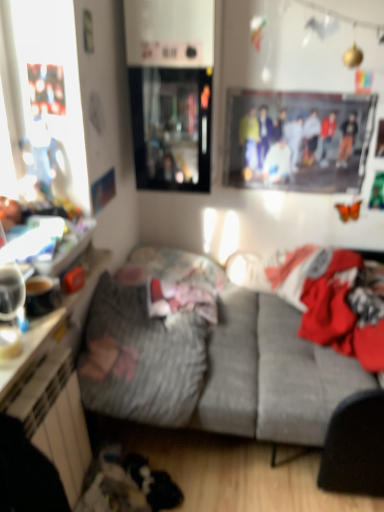
You are a GUI agent. You are given a task and a screenshot of the screen. Output one action in this format:
    pyautogui.click(x=<x>, y=<y>)
    Task: Click on the white glossy dresser at lower left
    Image resolution: width=384 pixels, height=512 pixels.
    Given the screenshot: What is the action you would take?
    pyautogui.click(x=57, y=378)

Measure the distance between printed fabric poster at upper center and camera.

printed fabric poster at upper center is 2.24 meters away from camera.

This screenshot has height=512, width=384. What do you see at coordinates (209, 360) in the screenshot?
I see `gray fabric couch at center` at bounding box center [209, 360].

Find the location of a particular element. The image size is (384, 512). transparent glass cabinet at upper center is located at coordinates (171, 127).

Considering the relative positions of transparent glass cabinet at upper center and white glossy dresser at lower left in the image provided, is transparent glass cabinet at upper center to the right of white glossy dresser at lower left from the viewer's perspective?

Yes.

Can you confirm if transparent glass cabinet at upper center is smaller than white glossy dresser at lower left?

Incorrect, transparent glass cabinet at upper center is not smaller in size than white glossy dresser at lower left.

In the scene shown: Is transparent glass cabinet at upper center directly adjacent to white glossy dresser at lower left?

They are not placed beside each other.

Measure the distance between transparent glass cabinet at upper center and white glossy dresser at lower left.

transparent glass cabinet at upper center is 90.31 centimeters away from white glossy dresser at lower left.

The image size is (384, 512). Find the location of `blanket in front of the transparent glass cabinet at upper center`. blanket in front of the transparent glass cabinet at upper center is located at coordinates (141, 358).

From the image's perspective, does transparent glass cabinet at upper center appear lower than fluffy gray blanket at center?

No.

Can you confirm if transparent glass cabinet at upper center is wider than fluffy gray blanket at center?

No, transparent glass cabinet at upper center is not wider than fluffy gray blanket at center.

At what (x,y) coordinates should I click in order to perform the action: click on couple on the right of gray fabric couch at center. Please return your answer as a coordinate pair (x, y). Image resolution: width=384 pixels, height=512 pixels. Looking at the image, I should click on (281, 143).

Is point (280, 178) farther from camera compared to point (189, 362)?

Yes.

Between printed fabric poster at upper center and gray fabric couch at center, which one appears on the right side from the viewer's perspective?

printed fabric poster at upper center is more to the right.

Who is bigger, printed fabric poster at upper center or gray fabric couch at center?

gray fabric couch at center is bigger.

Does red fabric laundry at center turn towards transparent glass cabinet at upper center?

No.

Which is closer, (337,251) or (161,137)?

Point (337,251) is positioned farther from the camera compared to point (161,137).

Find the location of `window screen behind the red fabric laundry at center`. window screen behind the red fabric laundry at center is located at coordinates (171, 127).

Between transparent glass cabinet at upper center and red fabric laundry at center, which one has less height?

red fabric laundry at center.

In the scene shown: Looking at the image, does transparent glass cabinet at upper center seem bigger or smaller compared to red fabric laundry at center?

In the image, transparent glass cabinet at upper center appears to be smaller than red fabric laundry at center.

From the image's perspective, which object appears higher, transparent glass cabinet at upper center or red fabric laundry at center?

transparent glass cabinet at upper center is shown above in the image.

Find the location of a particular element. This screenshot has width=384, height=512. laundry below the transparent glass cabinet at upper center (from the image's perspective) is located at coordinates (318, 298).

Considering the sizes of objects gray fabric couch at center and transparent glass cabinet at upper center in the image provided, who is wider, gray fabric couch at center or transparent glass cabinet at upper center?

gray fabric couch at center.

Is gray fabric couch at center smaller than transparent glass cabinet at upper center?

No.

Are gray fabric couch at center and transparent glass cabinet at upper center located far from each other?

That's not correct — gray fabric couch at center is a little close to transparent glass cabinet at upper center.

Could you tell me if gray fabric couch at center is turned towards transparent glass cabinet at upper center?

No, gray fabric couch at center is not facing towards transparent glass cabinet at upper center.

Can you confirm if fluffy gray blanket at center is smaller than gray fabric couch at center?

Indeed, fluffy gray blanket at center has a smaller size compared to gray fabric couch at center.

From the image's perspective, which is below, fluffy gray blanket at center or gray fabric couch at center?

gray fabric couch at center appears lower in the image.

The image size is (384, 512). Find the location of `window screen lying above the white glossy dresser at lower left (from the image's perspective)`. window screen lying above the white glossy dresser at lower left (from the image's perspective) is located at coordinates (171, 127).

The width and height of the screenshot is (384, 512). In order to click on blanket that is below the transparent glass cabinet at upper center (from the image's perspective) in this screenshot , I will do `click(141, 358)`.

Considering their positions, is fluffy gray blanket at center positioned further to printed fabric poster at upper center than transparent glass cabinet at upper center?

fluffy gray blanket at center lies further to printed fabric poster at upper center than the other object.

When comparing their distances from gray fabric couch at center, does white glossy dresser at lower left or fluffy gray blanket at center seem further?

white glossy dresser at lower left is positioned further to the anchor gray fabric couch at center.

From the image, which object appears to be nearer to gray fabric couch at center, transparent glass cabinet at upper center or red fabric laundry at center?

Based on the image, red fabric laundry at center appears to be nearer to gray fabric couch at center.

Looking at the image, which one is located further to gray fabric couch at center, white glossy dresser at lower left or red fabric laundry at center?

white glossy dresser at lower left lies further to gray fabric couch at center than the other object.

Considering their positions, is red fabric laundry at center positioned closer to gray fabric couch at center than transparent glass cabinet at upper center?

red fabric laundry at center lies closer to gray fabric couch at center than the other object.

Looking at the image, which one is located further to transparent glass cabinet at upper center, white glossy dresser at lower left or fluffy gray blanket at center?

fluffy gray blanket at center is further to transparent glass cabinet at upper center.

Estimate the real-world distances between objects in this image. Which object is further from transparent glass cabinet at upper center, gray fabric couch at center or printed fabric poster at upper center?

Among the two, gray fabric couch at center is located further to transparent glass cabinet at upper center.

Estimate the real-world distances between objects in this image. Which object is further from white glossy dresser at lower left, red fabric laundry at center or transparent glass cabinet at upper center?

red fabric laundry at center lies further to white glossy dresser at lower left than the other object.

The height and width of the screenshot is (512, 384). Find the location of `couple between transparent glass cabinet at upper center and red fabric laundry at center in the vertical direction`. couple between transparent glass cabinet at upper center and red fabric laundry at center in the vertical direction is located at coordinates (281, 143).

What are the coordinates of `laundry between printed fabric poster at upper center and fluffy gray blanket at center vertically` in the screenshot? It's located at (318, 298).

Identify the location of studio couch between printed fabric poster at upper center and white glossy dresser at lower left in the up-down direction. The height and width of the screenshot is (512, 384). (209, 360).

You are a GUI agent. You are given a task and a screenshot of the screen. Output one action in this format:
    pyautogui.click(x=<x>, y=<y>)
    Task: Click on the blanket between white glossy dresser at lower left and gray fabric couch at center from left to right
    This screenshot has height=512, width=384.
    Given the screenshot: What is the action you would take?
    pyautogui.click(x=141, y=358)